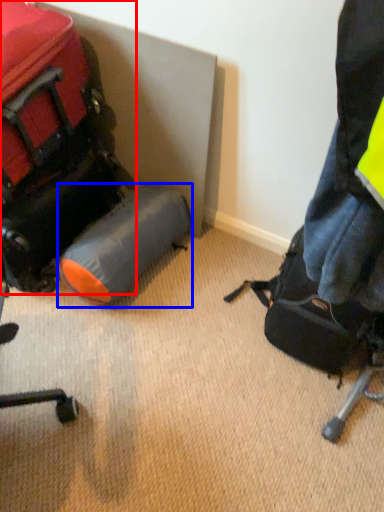
Question: Which point is further to the camera, luggage and bags (highlighted by a red box) or luggage (highlighted by a blue box)?

Choices:
 (A) luggage and bags
 (B) luggage

Answer: (B)